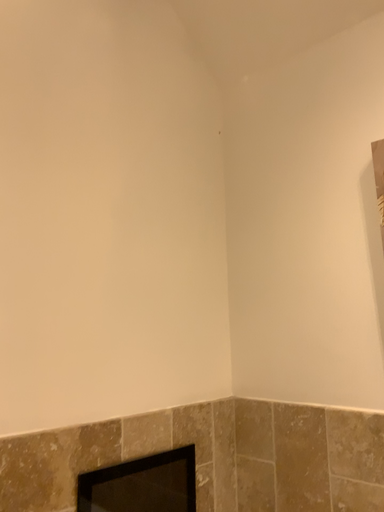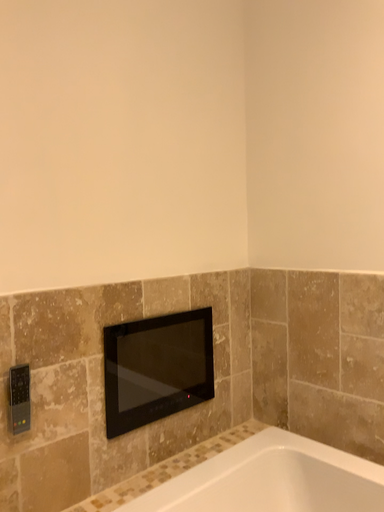
Question: How did the camera likely rotate when shooting the video?

Choices:
 (A) rotated downward
 (B) rotated upward

Answer: (A)